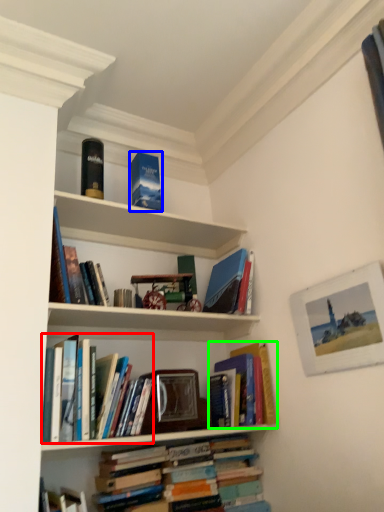
Question: Based on their relative distances, which object is farther from book (highlighted by a red box)? Choose from paperback book (highlighted by a blue box) and book (highlighted by a green box).

Choices:
 (A) paperback book
 (B) book

Answer: (A)